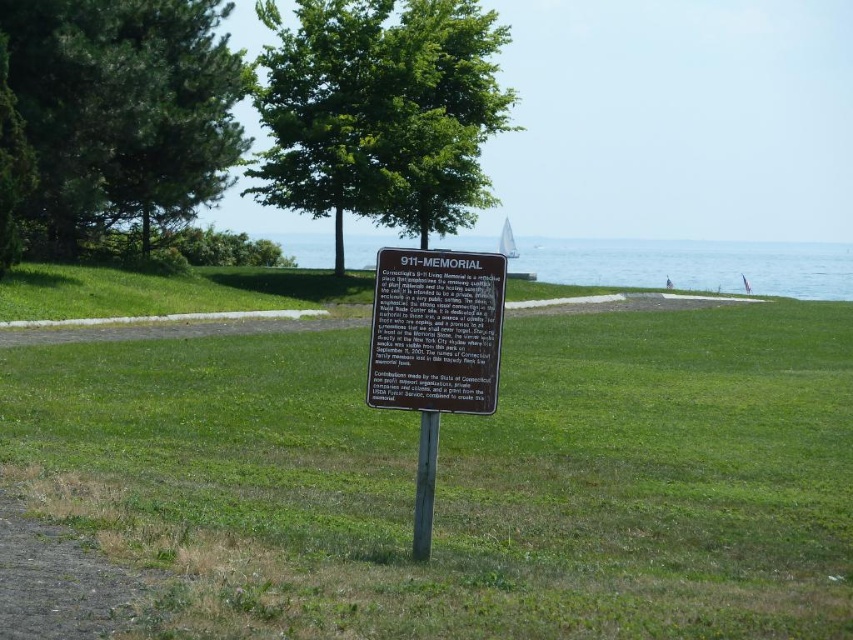
Can you confirm if green grass at center is positioned to the right of green textured pine tree at upper left?

Correct, you'll find green grass at center to the right of green textured pine tree at upper left.

Which is more to the right, green grass at center or green textured pine tree at upper left?

green grass at center

I want to click on green grass at center, so click(465, 480).

Find the location of a particular element. green grass at center is located at coordinates click(465, 480).

Does blue water at center have a lesser height compared to dull gray gravel at lower left?

No.

Which of these two, blue water at center or dull gray gravel at lower left, stands shorter?

With less height is dull gray gravel at lower left.

Looking at this image, measure the distance between point (848, 268) and camera.

A distance of 314.06 feet exists between point (848, 268) and camera.

Find the location of `blue water at center`. blue water at center is located at coordinates (692, 266).

Which of these two, green leafy tree at upper center or dull gray gravel at lower left, stands shorter?

Standing shorter between the two is dull gray gravel at lower left.

Is green leafy tree at upper center above dull gray gravel at lower left?

Indeed, green leafy tree at upper center is positioned over dull gray gravel at lower left.

Does point (422, 81) lie in front of point (74, 632)?

No, (422, 81) is further to viewer.

Identify the location of green leafy tree at upper center. This screenshot has width=853, height=640. coord(380,112).